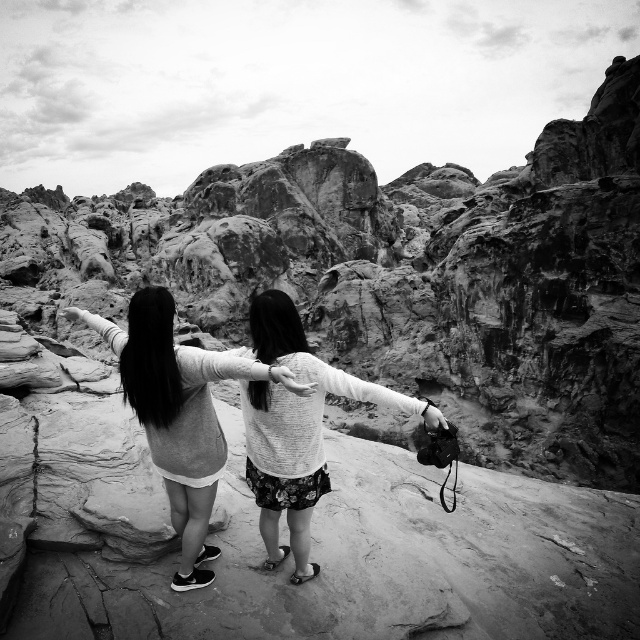
You are trying to decide which sweater to wear for a hike. You see the light gray sweater at center and the fluffy white sweater at center in the photo. Which one reaches higher up on the person?

The fluffy white sweater at center is taller than the light gray sweater at center, so it reaches higher up on the person.

Looking at this image, you are standing at the point marked by the coordinates point (x=179, y=413) in the image. Looking around, you see the rugged landscape and two people. What object is located at your current position?

Result: The point (x=179, y=413) corresponds to the light gray sweater at center.